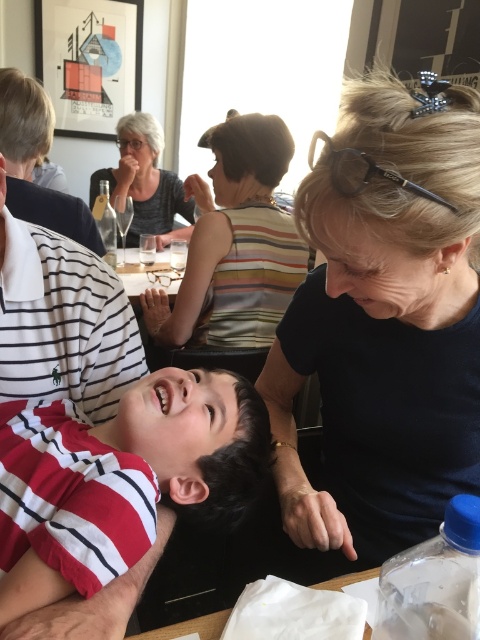
You are a photographer trying to capture a candid shot of the scene. You notice a point at coordinates (x=122, y=477). What object is located at this point?

The point at coordinates (x=122, y=477) marks the red striped shirt at lower left.